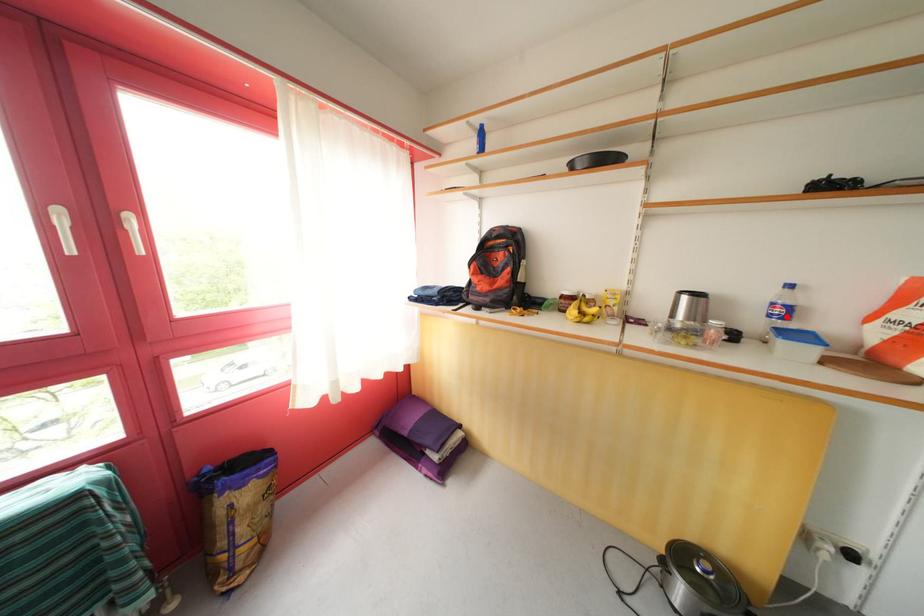
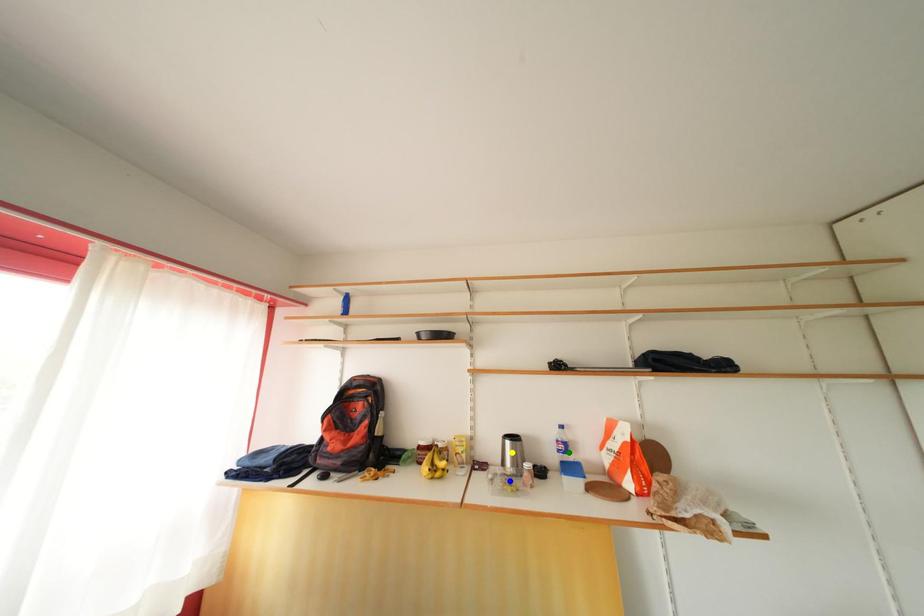
Question: I am providing you with two images of the same scene from different viewpoints. A red point is marked on the first image. You are given multiple points on the second image. Can you choose the point in image 2 that corresponds to the point in image 1?

Choices:
 (A) blue point
 (B) yellow point
 (C) green point

Answer: (C)